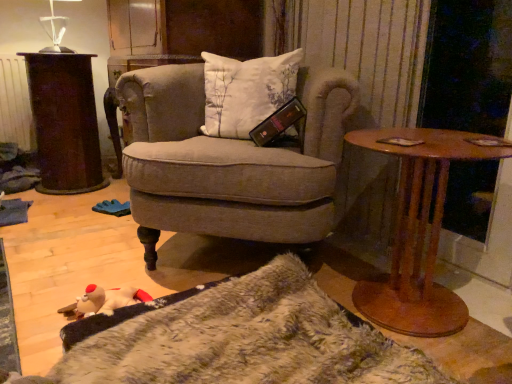
What do you see at coordinates (418, 232) in the screenshot? I see `brown wooden table at right` at bounding box center [418, 232].

Find the location of a particular element. transparent glass table lamp at upper left is located at coordinates (55, 30).

Measure the distance between point (57,177) and camera.

2.30 meters.

Where is `textured beige armchair at center`? The height and width of the screenshot is (384, 512). textured beige armchair at center is located at coordinates click(228, 163).

Is the position of rusty metal trash can at left less distant than that of textured beige armchair at center?

No, rusty metal trash can at left is further to the viewer.

Would you say rusty metal trash can at left is a long distance from textured beige armchair at center?

Yes, rusty metal trash can at left and textured beige armchair at center are quite far apart.

Considering the positions of points (48, 156) and (225, 153), is point (48, 156) closer to camera compared to point (225, 153)?

No, (48, 156) is behind (225, 153).

From the image's perspective, which object appears higher, rusty metal trash can at left or textured beige armchair at center?

rusty metal trash can at left appears higher in the image.

Between point (69, 124) and point (44, 49), which one is positioned behind?

Positioned behind is point (44, 49).

Does rusty metal trash can at left turn towards transparent glass table lamp at upper left?

No, rusty metal trash can at left is not aimed at transparent glass table lamp at upper left.

Which is in front, rusty metal trash can at left or transparent glass table lamp at upper left?

transparent glass table lamp at upper left is more forward.

Identify the location of table lamp that is above the brown wooden table at right (from a real-world perspective). (55, 30).

Would you say transparent glass table lamp at upper left is part of brown wooden table at right's contents?

Definitely not — transparent glass table lamp at upper left is not inside brown wooden table at right.

Looking at this image, is brown wooden table at right positioned with its back to transparent glass table lamp at upper left?

brown wooden table at right does not have its back to transparent glass table lamp at upper left.

Does brown wooden table at right have a lesser width compared to transparent glass table lamp at upper left?

No.

Which of these two, textured beige armchair at center or brown wooden table at right, is thinner?

Thinner between the two is brown wooden table at right.

Is textured beige armchair at center taller or shorter than brown wooden table at right?

In the image, textured beige armchair at center appears to be taller than brown wooden table at right.

How distant is textured beige armchair at center from brown wooden table at right?

37.08 centimeters.

Does point (207, 199) lie in front of point (456, 295)?

Yes, point (207, 199) is in front of point (456, 295).

Between rusty metal trash can at left and brown wooden table at right, which one is positioned behind?

rusty metal trash can at left is behind.

Based on their sizes in the image, would you say rusty metal trash can at left is bigger or smaller than brown wooden table at right?

Clearly, rusty metal trash can at left is larger in size than brown wooden table at right.

From the image's perspective, which one is positioned higher, rusty metal trash can at left or brown wooden table at right?

rusty metal trash can at left, from the image's perspective.

From a real-world perspective, who is located lower, rusty metal trash can at left or brown wooden table at right?

In real-world perspective, brown wooden table at right is lower.

Can you see transparent glass table lamp at upper left touching textured beige armchair at center?

transparent glass table lamp at upper left and textured beige armchair at center are clearly separated.

From the image's perspective, is transparent glass table lamp at upper left positioned above or below textured beige armchair at center?

transparent glass table lamp at upper left is above textured beige armchair at center.

Considering the relative sizes of transparent glass table lamp at upper left and textured beige armchair at center in the image provided, is transparent glass table lamp at upper left shorter than textured beige armchair at center?

Indeed, transparent glass table lamp at upper left has a lesser height compared to textured beige armchair at center.

Which is more to the right, transparent glass table lamp at upper left or textured beige armchair at center?

textured beige armchair at center.

Considering the sizes of objects textured beige armchair at center and rusty metal trash can at left in the image provided, who is shorter, textured beige armchair at center or rusty metal trash can at left?

rusty metal trash can at left.

Choose the correct answer: Is textured beige armchair at center inside rusty metal trash can at left or outside it?

textured beige armchair at center is spatially situated outside rusty metal trash can at left.

Consider the image. How far apart are textured beige armchair at center and rusty metal trash can at left?

textured beige armchair at center is 1.12 meters away from rusty metal trash can at left.

Considering their positions, is textured beige armchair at center located in front of or behind rusty metal trash can at left?

In the image, textured beige armchair at center appears in front of rusty metal trash can at left.

What are the coordinates of `table located above the textured beige armchair at center (from a real-world perspective)` in the screenshot? It's located at tap(65, 122).

Locate an element on the screen. The image size is (512, 384). table lamp on the right of rusty metal trash can at left is located at coordinates (55, 30).

When comparing their distances from brown wooden table at right, does textured beige armchair at center or transparent glass table lamp at upper left seem further?

transparent glass table lamp at upper left is positioned further to the anchor brown wooden table at right.

Considering their positions, is rusty metal trash can at left positioned closer to textured beige armchair at center than transparent glass table lamp at upper left?

rusty metal trash can at left.

Looking at the image, which one is located further to rusty metal trash can at left, brown wooden table at right or textured beige armchair at center?

The object further to rusty metal trash can at left is brown wooden table at right.

Estimate the real-world distances between objects in this image. Which object is further from transparent glass table lamp at upper left, rusty metal trash can at left or brown wooden table at right?

brown wooden table at right lies further to transparent glass table lamp at upper left than the other object.

Considering their positions, is transparent glass table lamp at upper left positioned closer to rusty metal trash can at left than brown wooden table at right?

Based on the image, transparent glass table lamp at upper left appears to be nearer to rusty metal trash can at left.

Based on their spatial positions, is textured beige armchair at center or brown wooden table at right further from rusty metal trash can at left?

brown wooden table at right lies further to rusty metal trash can at left than the other object.

Looking at the image, which one is located further to textured beige armchair at center, transparent glass table lamp at upper left or rusty metal trash can at left?

Based on the image, transparent glass table lamp at upper left appears to be further to textured beige armchair at center.

From the image, which object appears to be farther from transparent glass table lamp at upper left, brown wooden table at right or rusty metal trash can at left?

brown wooden table at right lies further to transparent glass table lamp at upper left than the other object.

This screenshot has height=384, width=512. Identify the location of chair located between rusty metal trash can at left and brown wooden table at right in the left-right direction. (228, 163).

Where is `chair situated between transparent glass table lamp at upper left and brown wooden table at right from left to right`? chair situated between transparent glass table lamp at upper left and brown wooden table at right from left to right is located at coordinates (228, 163).

The height and width of the screenshot is (384, 512). Identify the location of table lamp between rusty metal trash can at left and textured beige armchair at center from left to right. (55, 30).

Locate an element on the screen. This screenshot has width=512, height=384. table lamp between rusty metal trash can at left and brown wooden table at right from left to right is located at coordinates (55, 30).